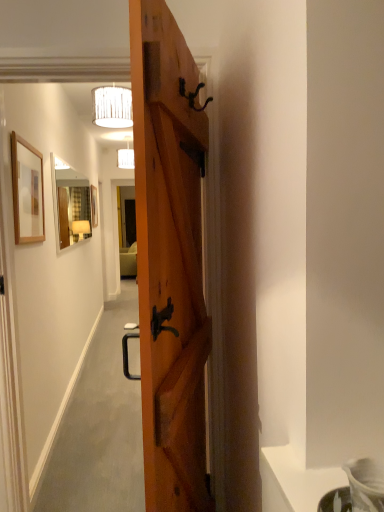
The width and height of the screenshot is (384, 512). What do you see at coordinates (126, 157) in the screenshot? I see `matte white lampshade at upper center, placed as the 2th lamp when sorted from right to left` at bounding box center [126, 157].

Find the location of a particular element. The width and height of the screenshot is (384, 512). matte white lampshade at upper center, placed as the 2th lamp when sorted from right to left is located at coordinates [x=126, y=157].

What do you see at coordinates (112, 106) in the screenshot? Image resolution: width=384 pixels, height=512 pixels. I see `white fabric lampshade at upper center, which appears as the first lamp when viewed from the right` at bounding box center [112, 106].

Find the location of a particular element. This screenshot has height=512, width=384. wooden door at center is located at coordinates (169, 261).

You are a GUI agent. You are given a task and a screenshot of the screen. Output one action in this format:
    pyautogui.click(x=<x>, y=<y>)
    Task: Click on the wooden picture frame at center, arranged as the second picture frame when viewed from the front
    This screenshot has width=384, height=512.
    Given the screenshot: What is the action you would take?
    pyautogui.click(x=94, y=206)

Does wooden door at center have a smaller size compared to metallic dark brown door handle at upper center?

No, wooden door at center is not smaller than metallic dark brown door handle at upper center.

In the image, is wooden door at center positioned in front of or behind metallic dark brown door handle at upper center?

wooden door at center is in front of metallic dark brown door handle at upper center.

Is point (95, 194) closer or farther from the camera than point (94, 100)?

Point (95, 194) is positioned farther from the camera compared to point (94, 100).

Can you confirm if wooden picture frame at center, arranged as the second picture frame when viewed from the front, is bigger than white fabric lampshade at upper center, which is counted as the 1th lamp, starting from the front?

Yes, wooden picture frame at center, arranged as the second picture frame when viewed from the front, is bigger than white fabric lampshade at upper center, which is counted as the 1th lamp, starting from the front.

Looking at this image, how many degrees apart are the facing directions of wooden picture frame at center, arranged as the second picture frame when viewed from the front, and white fabric lampshade at upper center, the second lamp when ordered from left to right?

They differ by 90.7 degrees in their facing directions.

Is wooden picture frame at center, placed as the first picture frame when sorted from back to front, turned away from white fabric lampshade at upper center, which is counted as the 1th lamp, starting from the front?

wooden picture frame at center, placed as the first picture frame when sorted from back to front, does not have its back to white fabric lampshade at upper center, which is counted as the 1th lamp, starting from the front.

Considering the sizes of objects white fabric lampshade at upper center, which is counted as the 1th lamp, starting from the front, and matte wooden mirror at upper center in the image provided, who is smaller, white fabric lampshade at upper center, which is counted as the 1th lamp, starting from the front, or matte wooden mirror at upper center?

With smaller size is white fabric lampshade at upper center, which is counted as the 1th lamp, starting from the front.

Which is behind, point (97, 93) or point (75, 188)?

Positioned behind is point (75, 188).

Which is more to the left, white fabric lampshade at upper center, which ranks as the 2th lamp in back-to-front order, or matte wooden mirror at upper center?

matte wooden mirror at upper center is more to the left.

In terms of width, does white fabric lampshade at upper center, which appears as the first lamp when viewed from the right, look wider or thinner when compared to wooden picture frame at upper left, placed as the 2th picture frame when sorted from left to right?

Considering their sizes, white fabric lampshade at upper center, which appears as the first lamp when viewed from the right, looks broader than wooden picture frame at upper left, placed as the 2th picture frame when sorted from left to right.

Which lamp is the 1st one when counting from the back of the wooden picture frame at upper left, placed as the 2th picture frame when sorted from back to front? Please provide its 2D coordinates.

[(112, 106)]

Between white fabric lampshade at upper center, the second lamp when ordered from left to right, and wooden picture frame at upper left, placed as the 2th picture frame when sorted from left to right, which one has more height?

Standing taller between the two is wooden picture frame at upper left, placed as the 2th picture frame when sorted from left to right.

Which object is further away from the camera taking this photo, white fabric lampshade at upper center, which appears as the first lamp when viewed from the right, or wooden picture frame at upper left, placed as the 2th picture frame when sorted from back to front?

Positioned behind is white fabric lampshade at upper center, which appears as the first lamp when viewed from the right.

Where is `door handle located in front of the matte wooden mirror at upper center`? This screenshot has height=512, width=384. door handle located in front of the matte wooden mirror at upper center is located at coordinates 193,95.

Which of these two, matte wooden mirror at upper center or metallic dark brown door handle at upper center, is bigger?

Bigger between the two is matte wooden mirror at upper center.

Could you tell me if matte wooden mirror at upper center is facing metallic dark brown door handle at upper center?

No, matte wooden mirror at upper center is not turned towards metallic dark brown door handle at upper center.

Is wooden door at center completely or partially outside of matte wooden mirror at upper center?

Yes.

From a real-world perspective, which is physically below, wooden door at center or matte wooden mirror at upper center?

wooden door at center, from a real-world perspective.

Is wooden door at center taller or shorter than matte wooden mirror at upper center?

In the image, wooden door at center appears to be taller than matte wooden mirror at upper center.

Which is more to the left, wooden door at center or matte wooden mirror at upper center?

matte wooden mirror at upper center is more to the left.

Who is taller, metallic dark brown door handle at upper center or wooden picture frame at center, acting as the 2th picture frame starting from the right?

Standing taller between the two is wooden picture frame at center, acting as the 2th picture frame starting from the right.

What's the angular difference between metallic dark brown door handle at upper center and wooden picture frame at center, placed as the first picture frame when sorted from back to front,'s facing directions?

The angular difference between metallic dark brown door handle at upper center and wooden picture frame at center, placed as the first picture frame when sorted from back to front, is 17.3 degrees.

At what (x,y) coordinates should I click in order to perform the action: click on door handle lying in front of the wooden picture frame at center, acting as the 2th picture frame starting from the right. Please return your answer as a coordinate pair (x, y). The width and height of the screenshot is (384, 512). Looking at the image, I should click on (193, 95).

Image resolution: width=384 pixels, height=512 pixels. There is a wooden door at center. What are the coordinates of `door handle above it (from a real-world perspective)` in the screenshot? It's located at (193, 95).

Locate an element on the screen. lamp that is the 2nd one when counting rightward from the wooden picture frame at center, positioned as the 1th picture frame in left-to-right order is located at coordinates pyautogui.click(x=112, y=106).

Estimate the real-world distances between objects in this image. Which object is closer to wooden picture frame at center, placed as the first picture frame when sorted from back to front, matte wooden mirror at upper center or metallic dark brown door handle at upper center?

The object closer to wooden picture frame at center, placed as the first picture frame when sorted from back to front, is matte wooden mirror at upper center.

From the image, which object appears to be nearer to metallic dark brown door handle at upper center, wooden picture frame at upper left, which is the 1th picture frame from right to left, or wooden picture frame at center, arranged as the second picture frame when viewed from the front?

wooden picture frame at upper left, which is the 1th picture frame from right to left, is closer to metallic dark brown door handle at upper center.

Considering their positions, is metallic dark brown door handle at upper center positioned closer to wooden picture frame at upper left, placed as the 2th picture frame when sorted from left to right, than matte wooden mirror at upper center?

The object closer to wooden picture frame at upper left, placed as the 2th picture frame when sorted from left to right, is metallic dark brown door handle at upper center.

From the image, which object appears to be farther from metallic dark brown door handle at upper center, matte white lampshade at upper center, acting as the second lamp starting from the front, or wooden door at center?

matte white lampshade at upper center, acting as the second lamp starting from the front, is positioned further to the anchor metallic dark brown door handle at upper center.

From the image, which object appears to be farther from wooden picture frame at upper left, the 1th picture frame positioned from the front, white fabric lampshade at upper center, which is counted as the 1th lamp, starting from the front, or matte wooden mirror at upper center?

matte wooden mirror at upper center is further to wooden picture frame at upper left, the 1th picture frame positioned from the front.

Considering their positions, is white fabric lampshade at upper center, the second lamp when ordered from left to right, positioned further to wooden picture frame at upper left, placed as the 2th picture frame when sorted from back to front, than metallic dark brown door handle at upper center?

The object further to wooden picture frame at upper left, placed as the 2th picture frame when sorted from back to front, is metallic dark brown door handle at upper center.

When comparing their distances from white fabric lampshade at upper center, which ranks as the 2th lamp in back-to-front order, does matte wooden mirror at upper center or metallic dark brown door handle at upper center seem closer?

matte wooden mirror at upper center is closer to white fabric lampshade at upper center, which ranks as the 2th lamp in back-to-front order.

Estimate the real-world distances between objects in this image. Which object is closer to wooden picture frame at upper left, placed as the 2th picture frame when sorted from back to front, matte white lampshade at upper center, the 1th lamp viewed from the back, or metallic dark brown door handle at upper center?

metallic dark brown door handle at upper center is positioned closer to the anchor wooden picture frame at upper left, placed as the 2th picture frame when sorted from back to front.

This screenshot has width=384, height=512. Find the location of `mirror positioned between wooden door at center and matte white lampshade at upper center, the 1th lamp viewed from the back, from near to far`. mirror positioned between wooden door at center and matte white lampshade at upper center, the 1th lamp viewed from the back, from near to far is located at coordinates (70, 204).

This screenshot has height=512, width=384. Identify the location of mirror between metallic dark brown door handle at upper center and matte white lampshade at upper center, placed as the 2th lamp when sorted from right to left, from front to back. click(x=70, y=204).

The image size is (384, 512). What are the coordinates of `picture frame between wooden door at center and wooden picture frame at center, placed as the first picture frame when sorted from back to front, along the z-axis` in the screenshot? It's located at (27, 191).

This screenshot has height=512, width=384. What are the coordinates of `mirror between wooden picture frame at upper left, placed as the 2th picture frame when sorted from back to front, and matte white lampshade at upper center, acting as the second lamp starting from the front, from front to back` in the screenshot? It's located at (70, 204).